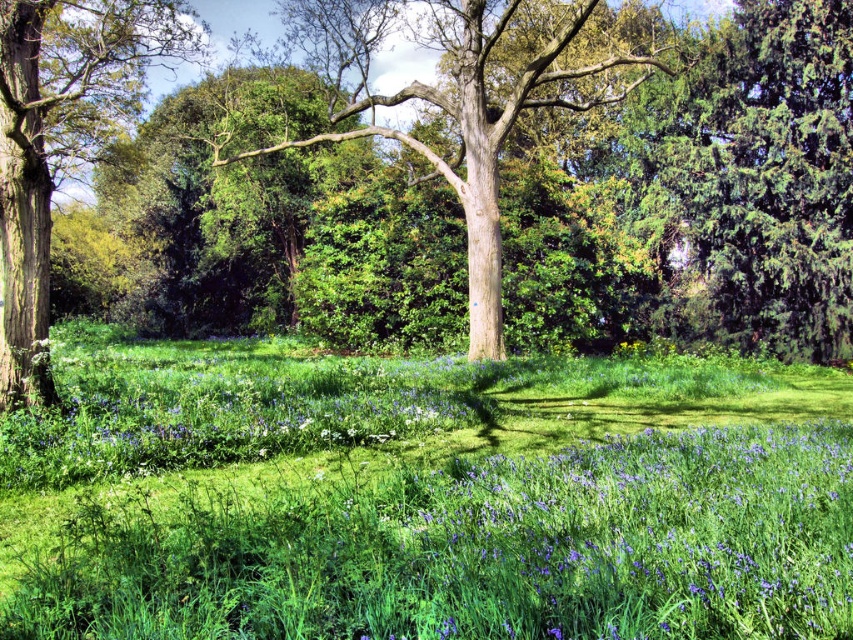
Who is shorter, smooth bark tree at center or smooth brown tree trunk at left?

smooth bark tree at center

Can you confirm if smooth bark tree at center is positioned below smooth brown tree trunk at left?

Yes, smooth bark tree at center is below smooth brown tree trunk at left.

Describe the element at coordinates (461, 99) in the screenshot. This screenshot has width=853, height=640. I see `smooth bark tree at center` at that location.

This screenshot has width=853, height=640. I want to click on smooth bark tree at center, so click(x=461, y=99).

Does point (764, 35) come behind point (15, 100)?

Yes, it is behind point (15, 100).

Between green textured evergreen tree at upper right and smooth brown tree trunk at left, which one is positioned higher?

smooth brown tree trunk at left is higher up.

Locate an element on the screen. green textured evergreen tree at upper right is located at coordinates (770, 173).

Where is `green textured evergreen tree at upper right`? green textured evergreen tree at upper right is located at coordinates (770, 173).

Is green grassy field at center closer to the viewer compared to smooth bark tree at center?

Yes, green grassy field at center is closer to the viewer.

Is point (227, 476) behind point (584, 67)?

No, (227, 476) is in front of (584, 67).

Locate an element on the screen. The height and width of the screenshot is (640, 853). green grassy field at center is located at coordinates (422, 496).